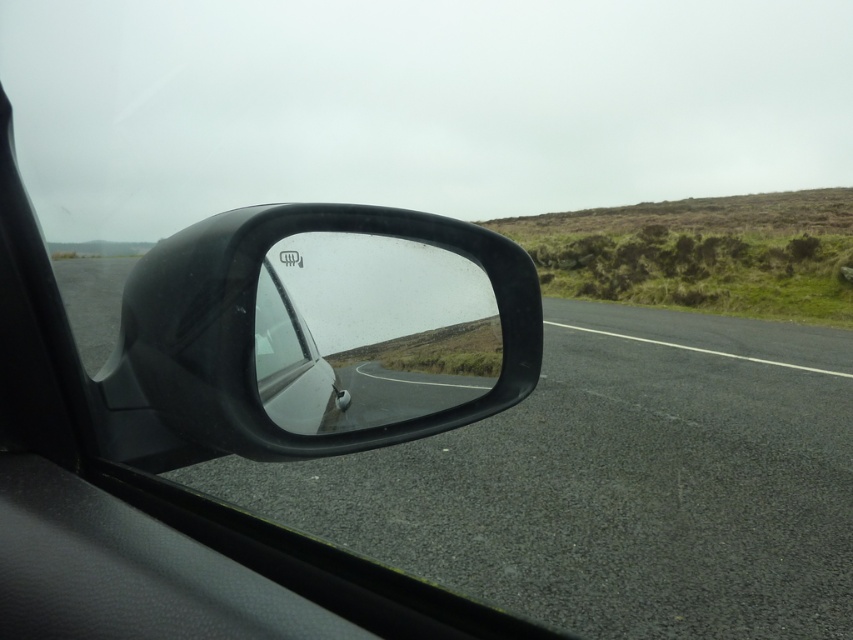
You are a passenger in a car and notice two mirrors at the center of the car. The black matte car mirror at center and the glossy plastic car mirror at center. Which one is positioned more to the left?

The black matte car mirror at center is positioned more to the left than the glossy plastic car mirror at center.

You are a driver checking the road conditions. Based on the scene, which object, the asphalt road at center or the glossy plastic car mirror at center, occupies a larger vertical space in the image?

The asphalt road at center is much taller than the glossy plastic car mirror at center, so the asphalt road at center occupies a larger vertical space.

You are a driver checking the road conditions. Based on the scene, which object, the asphalt road at center or the black matte car mirror at center, is taller when viewed from your perspective inside the vehicle?

The asphalt road at center is taller than the black matte car mirror at center when viewed from inside the vehicle.